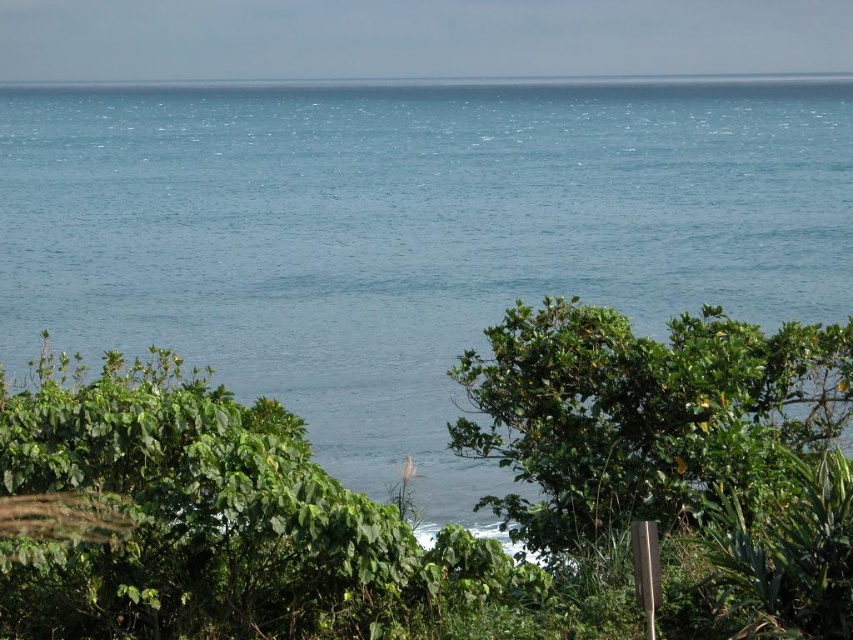
You are a photographer wanting to capture the entire scene in one shot. Given that your camera can only focus on objects within a 10m width, will the blue water at center and the green leafy tree at center both fit within the frame?

The blue water at center is wider than the green leafy tree at center. Since the camera can focus on objects within a 10m width, both objects will fit as their combined width does not exceed the limit.

You are standing on a cliff overlooking the coastal scene. You see the blue water at center and the green leafy tree at center. Which one appears taller from your viewpoint?

The blue water at center appears taller than the green leafy tree at center from your viewpoint because the blue water at center has a greater height compared to the green leafy tree at center.

You are standing on the beach in the coastal scene. Where is the blue water at center located in relation to your position?

The blue water at center is located at point 0.367 on the x axis and 0.479 on the y axis relative to your position.